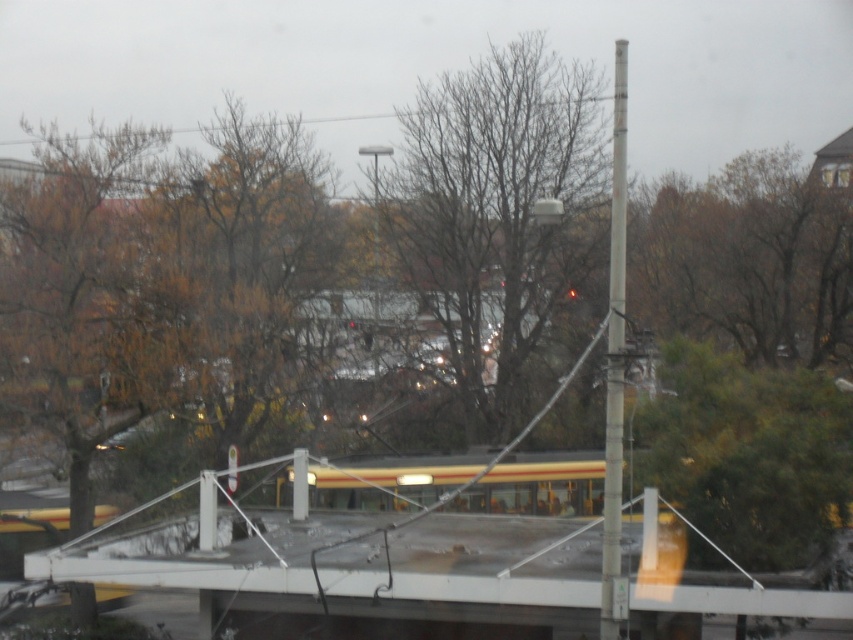
Question: Which of the following is the farthest from the observer?

Choices:
 (A) (222, 509)
 (B) (618, 408)
 (C) (592, 193)

Answer: (C)

Question: Is white concrete bridge at center positioned behind metallic gray pole at right?

Choices:
 (A) no
 (B) yes

Answer: (B)

Question: Does bare branches at center come behind yellow striped school bus at center?

Choices:
 (A) no
 (B) yes

Answer: (B)

Question: Which of the following is the farthest from the observer?

Choices:
 (A) (550, 461)
 (B) (421, 528)
 (C) (500, 230)
 (D) (604, 572)

Answer: (C)

Question: Which object appears farthest from the camera in this image?

Choices:
 (A) metallic gray pole at right
 (B) bare branches at center

Answer: (B)

Question: Does white concrete bridge at center have a smaller size compared to bare branches at center?

Choices:
 (A) no
 (B) yes

Answer: (B)